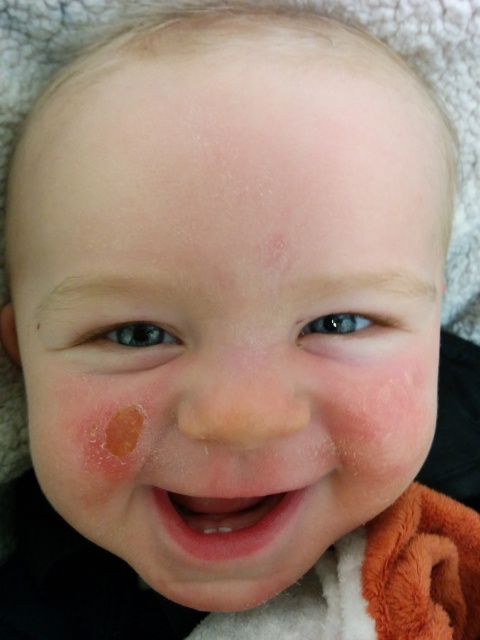
Question: Which point is closer to the camera taking this photo?

Choices:
 (A) (226, 428)
 (B) (189, 522)

Answer: (A)

Question: Considering the relative positions of smooth flesh-colored nose at center and pink smooth flesh at center in the image provided, where is smooth flesh-colored nose at center located with respect to pink smooth flesh at center?

Choices:
 (A) above
 (B) below

Answer: (A)

Question: Which object appears farthest from the camera in this image?

Choices:
 (A) smooth flesh-colored nose at center
 (B) pink smooth flesh at center

Answer: (B)

Question: Does smooth flesh-colored nose at center have a greater width compared to pink smooth flesh at center?

Choices:
 (A) yes
 (B) no

Answer: (B)

Question: Which point is closer to the camera taking this photo?

Choices:
 (A) (300, 422)
 (B) (235, 545)

Answer: (A)

Question: Can you confirm if smooth flesh-colored nose at center is smaller than pink smooth flesh at center?

Choices:
 (A) yes
 (B) no

Answer: (A)